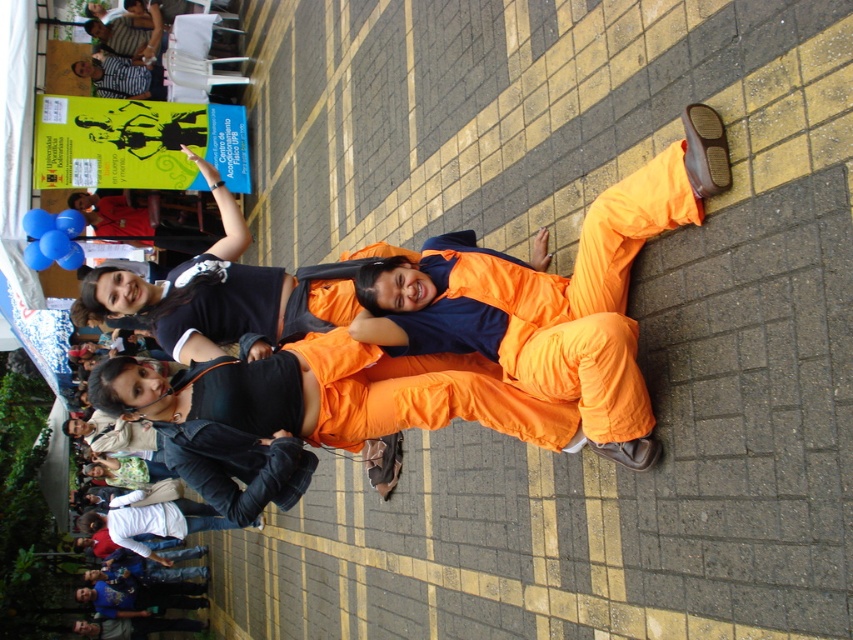
Is orange fabric jumpsuit at center bigger than orange fabric pants at center?

Correct, orange fabric jumpsuit at center is larger in size than orange fabric pants at center.

Who is higher up, orange fabric jumpsuit at center or orange fabric pants at center?

orange fabric pants at center is higher up.

The height and width of the screenshot is (640, 853). I want to click on orange fabric jumpsuit at center, so click(550, 292).